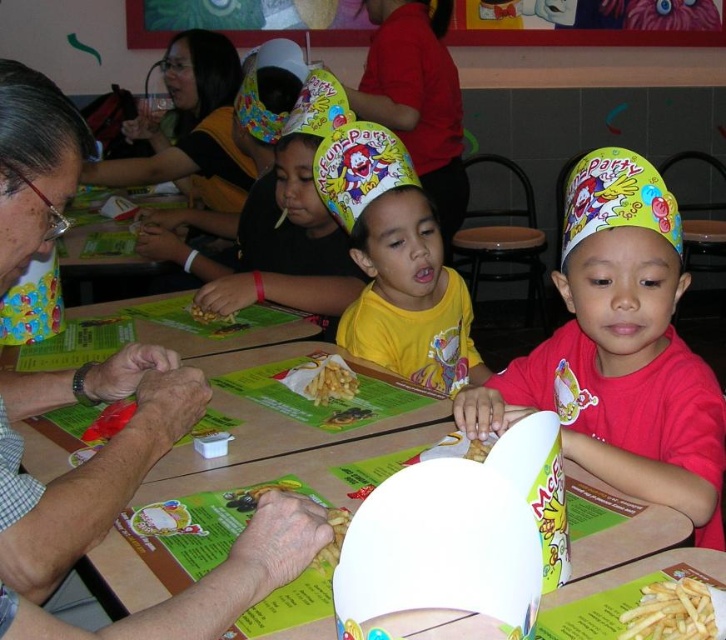
You are a parent trying to get your child to eat their golden crispy fries at center. Your child is distracted by the matte yellow hat at upper center. Which object is closer to the child so you can encourage them to focus on eating?

The matte yellow hat at upper center is to the left of the golden crispy fries at center, so it is closer to the child, making it harder for them to focus on the fries.